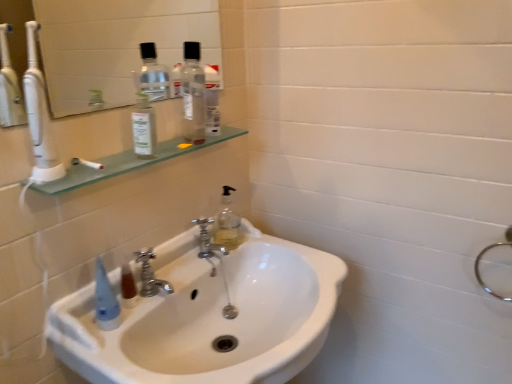
Question: Is silver metallic faucet at center, placed as the 2th tap when sorted from right to left, in front of transparent glass shelf at upper left?

Choices:
 (A) no
 (B) yes

Answer: (A)

Question: Considering the relative sizes of silver metallic faucet at center, acting as the first tap starting from the left, and transparent glass shelf at upper left in the image provided, is silver metallic faucet at center, acting as the first tap starting from the left, taller than transparent glass shelf at upper left?

Choices:
 (A) yes
 (B) no

Answer: (A)

Question: Can we say silver metallic faucet at center, the 1th tap viewed from the front, lies outside transparent glass shelf at upper left?

Choices:
 (A) no
 (B) yes

Answer: (B)

Question: Is transparent glass shelf at upper left at the back of silver metallic faucet at center, the 1th tap viewed from the front?

Choices:
 (A) yes
 (B) no

Answer: (B)

Question: Does silver metallic faucet at center, arranged as the second tap when viewed from the back, appear on the left side of transparent glass shelf at upper left?

Choices:
 (A) no
 (B) yes

Answer: (B)

Question: Is silver metallic faucet at center, arranged as the second tap when viewed from the back, to the right of transparent glass shelf at upper left from the viewer's perspective?

Choices:
 (A) no
 (B) yes

Answer: (A)

Question: Would you consider white glossy sink at center to be distant from transparent glass shelf at upper left?

Choices:
 (A) no
 (B) yes

Answer: (A)

Question: Is white glossy sink at center at the left side of transparent glass shelf at upper left?

Choices:
 (A) no
 (B) yes

Answer: (A)

Question: Does white glossy sink at center have a smaller size compared to transparent glass shelf at upper left?

Choices:
 (A) no
 (B) yes

Answer: (A)

Question: Is white glossy sink at center to the right of transparent glass shelf at upper left from the viewer's perspective?

Choices:
 (A) no
 (B) yes

Answer: (B)

Question: Does white glossy sink at center have a lesser height compared to transparent glass shelf at upper left?

Choices:
 (A) yes
 (B) no

Answer: (B)

Question: From the image's perspective, does white glossy sink at center appear lower than transparent glass shelf at upper left?

Choices:
 (A) yes
 (B) no

Answer: (A)

Question: Could white glossy sink at center be considered to be inside silver metallic faucet at center, the 1th tap viewed from the front?

Choices:
 (A) yes
 (B) no

Answer: (B)